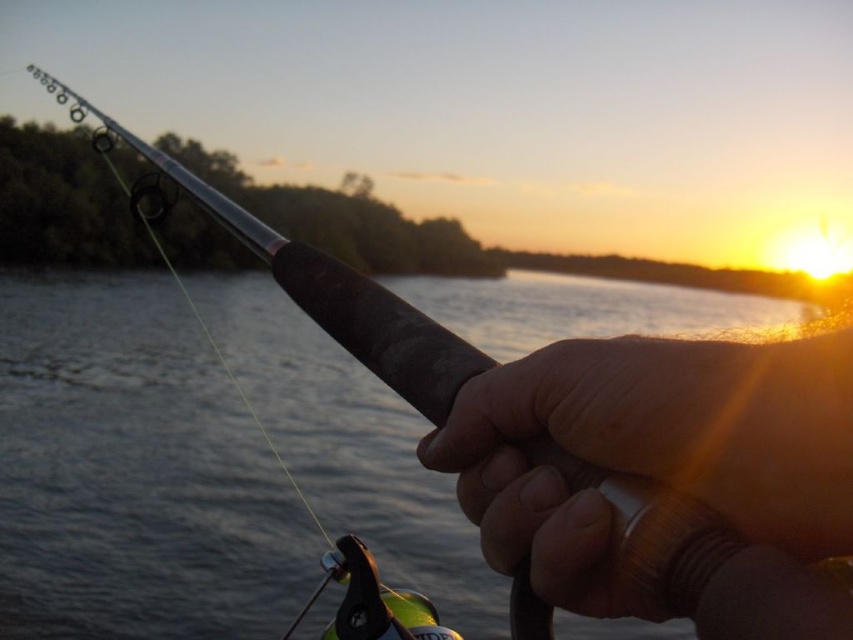
Is translucent water at fishing rod right smaller than smooth leather handle at center?

No, translucent water at fishing rod right is not smaller than smooth leather handle at center.

Who is shorter, translucent water at fishing rod right or smooth leather handle at center?

With less height is smooth leather handle at center.

The height and width of the screenshot is (640, 853). What do you see at coordinates (134, 472) in the screenshot?
I see `translucent water at fishing rod right` at bounding box center [134, 472].

Find the location of a particular element. translucent water at fishing rod right is located at coordinates (134, 472).